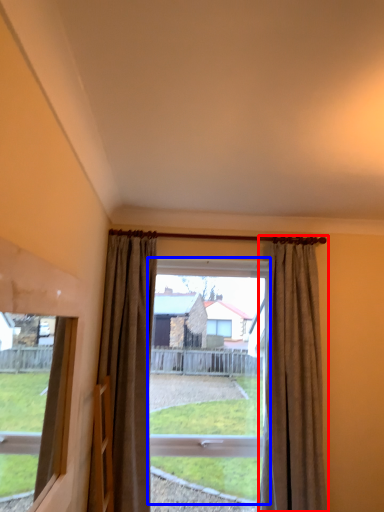
Question: Which point is further to the camera, curtain (highlighted by a red box) or bay window (highlighted by a blue box)?

Choices:
 (A) curtain
 (B) bay window

Answer: (B)